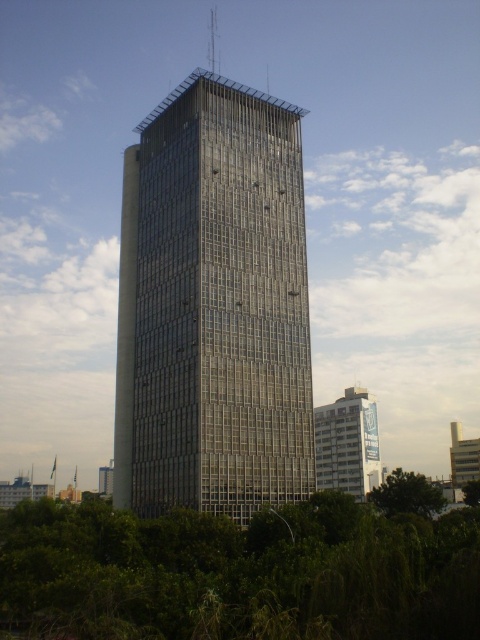
Consider the image. You are a drone operator planning to fly a drone from the transparent glass tower at center to the green leafy tree at lower center. Considering the size difference between them, which object will the drone reach first when flying straight towards both?

The drone will reach the green leafy tree at lower center first because the transparent glass tower at center is larger in size, meaning it is farther away from the drone operator compared to the green leafy tree at lower center.

You are an architect evaluating the building site. You need to determine if the transparent glass tower at center will block sunlight to the green leafy tree at lower right. Based on their heights, what can you conclude?

The transparent glass tower at center is taller than the green leafy tree at lower right, so it could potentially block sunlight depending on their positions.

You are standing in front of a modern architectural complex. You see a transparent glass tower at center and a white glossy building at lower right. Which building is nearer to you?

The transparent glass tower at center is closer to the viewer than the white glossy building at lower right.